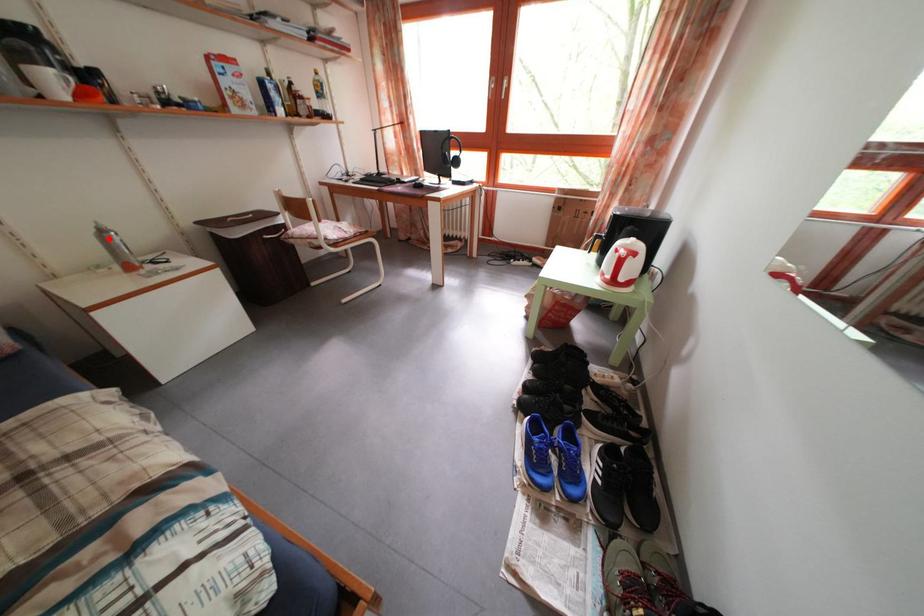
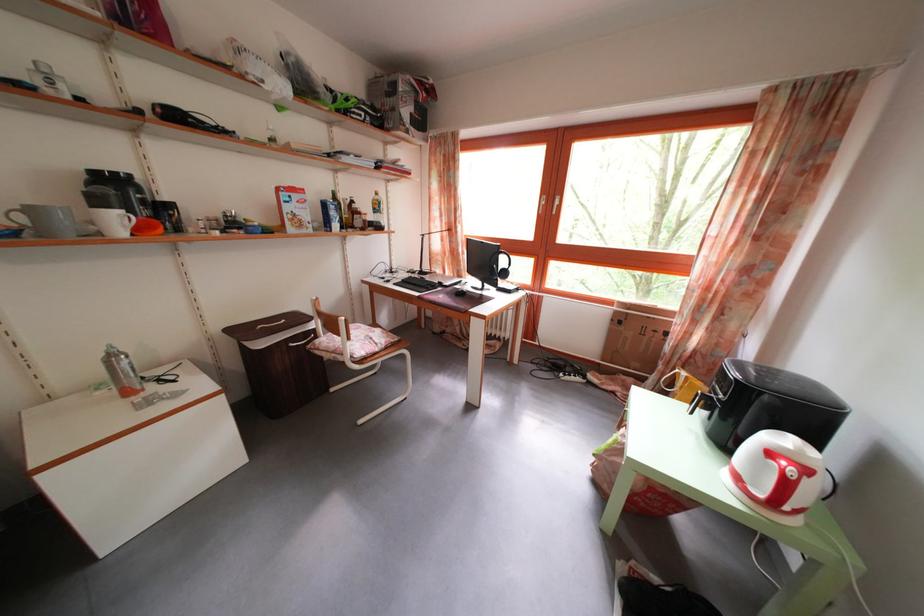
In the second image, find the point that corresponds to the highlighted location in the first image.

(118, 363)